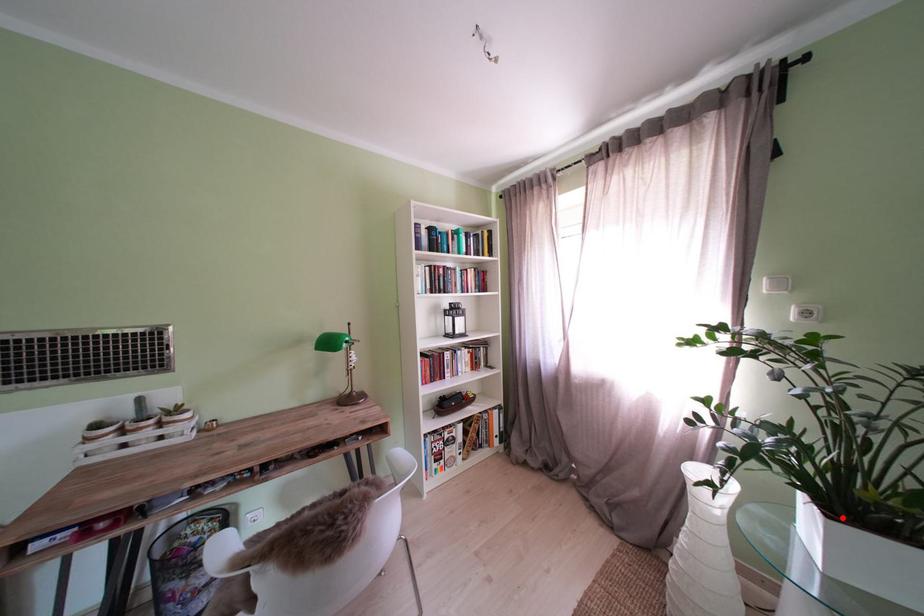
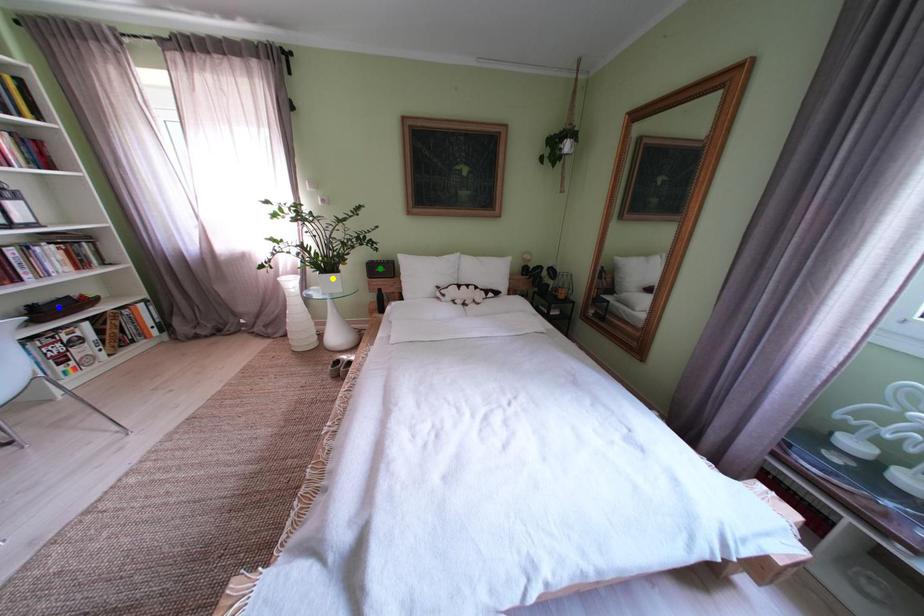
Question: I am providing you with two images of the same scene from different viewpoints. A red point is marked on the first image. You are given multiple points on the second image. Which point in image 2 is actually the same real-world point as the red point in image 1?

Choices:
 (A) green point
 (B) blue point
 (C) yellow point

Answer: (C)